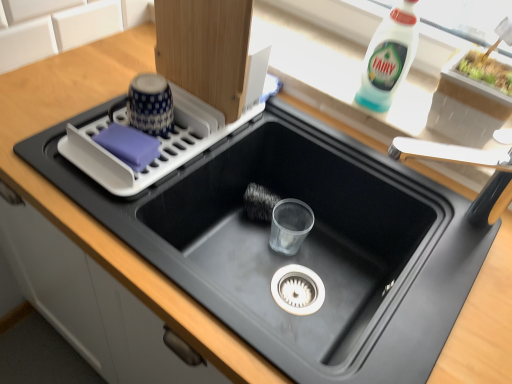
Question: In terms of width, does white plastic faucet at upper right look wider or thinner when compared to black matte sink at center?

Choices:
 (A) thin
 (B) wide

Answer: (A)

Question: Relative to black matte sink at center, is white plastic faucet at upper right in front or behind?

Choices:
 (A) front
 (B) behind

Answer: (B)

Question: Which of these objects is positioned farthest from the white plastic dish rack at upper left?

Choices:
 (A) white plastic faucet at upper right
 (B) black matte sink at center
 (C) white plastic bottle at upper right

Answer: (A)

Question: Considering the real-world distances, which object is closest to the white plastic bottle at upper right?

Choices:
 (A) white plastic dish rack at upper left
 (B) black matte sink at center
 (C) white plastic faucet at upper right

Answer: (C)